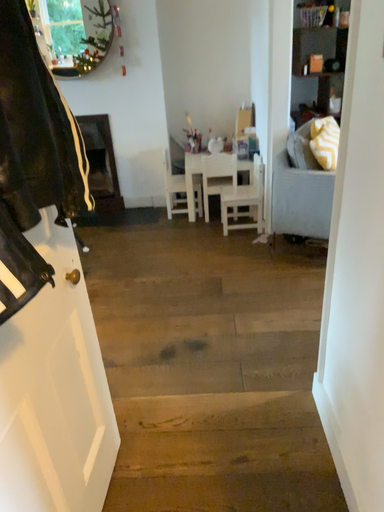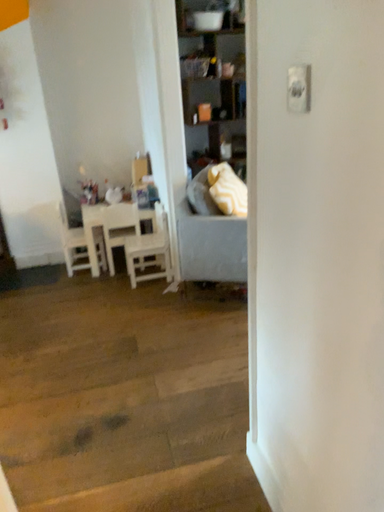
Question: Which way did the camera rotate in the video?

Choices:
 (A) rotated left
 (B) rotated right

Answer: (B)